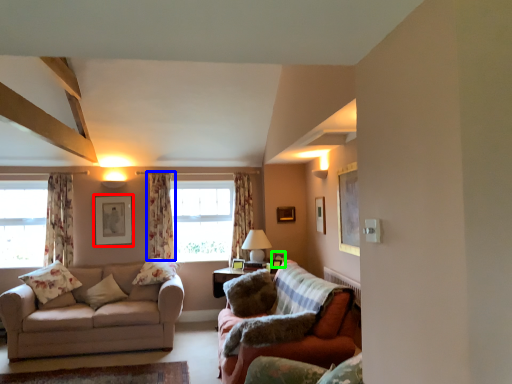
Question: Which object is the closest to the picture frame (highlighted by a red box)? Choose among these: curtain (highlighted by a blue box) or picture frame (highlighted by a green box).

Choices:
 (A) curtain
 (B) picture frame

Answer: (A)